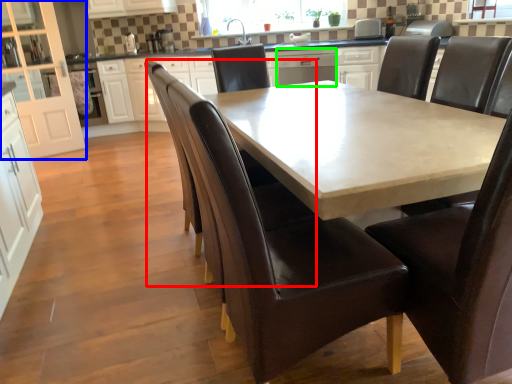
Question: Considering the real-world distances, which object is farthest from armchair (highlighted by a red box)? cabinetry (highlighted by a blue box) or dish washer (highlighted by a green box)?

Choices:
 (A) cabinetry
 (B) dish washer

Answer: (A)